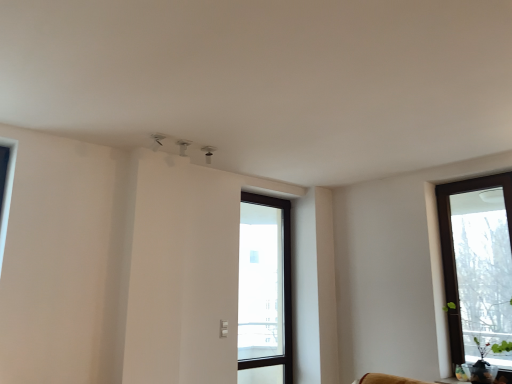
Question: From the image's perspective, does brown wooden window at right, arranged as the second window when viewed from the back, appear lower than transparent glass door at center, the second window in the front-to-back sequence?

Choices:
 (A) yes
 (B) no

Answer: (B)

Question: From a real-world perspective, is brown wooden window at right, acting as the first window starting from the right, physically above transparent glass door at center, arranged as the 2th window when viewed from the right?

Choices:
 (A) yes
 (B) no

Answer: (A)

Question: Would you consider brown wooden window at right, the first window from the front, to be distant from transparent glass door at center, arranged as the first window when viewed from the left?

Choices:
 (A) no
 (B) yes

Answer: (B)

Question: Is the depth of brown wooden window at right, the 2th window from the left, greater than that of transparent glass door at center, arranged as the 2th window when viewed from the right?

Choices:
 (A) no
 (B) yes

Answer: (A)

Question: Is brown wooden window at right, the first window from the front, turned away from transparent glass door at center, arranged as the 2th window when viewed from the right?

Choices:
 (A) yes
 (B) no

Answer: (B)

Question: Considering the relative sizes of brown wooden window at right, acting as the first window starting from the right, and transparent glass door at center, arranged as the first window when viewed from the left, in the image provided, is brown wooden window at right, acting as the first window starting from the right, smaller than transparent glass door at center, arranged as the first window when viewed from the left,?

Choices:
 (A) yes
 (B) no

Answer: (B)

Question: From the image's perspective, is transparent glass door at center, arranged as the first window when viewed from the left, on top of brown wooden window at right, arranged as the second window when viewed from the back?

Choices:
 (A) no
 (B) yes

Answer: (A)

Question: Does transparent glass door at center, arranged as the first window when viewed from the left, have a smaller size compared to brown wooden window at right, the first window from the front?

Choices:
 (A) yes
 (B) no

Answer: (A)

Question: Is brown wooden window at right, the first window from the front, at the back of transparent glass door at center, the second window in the front-to-back sequence?

Choices:
 (A) no
 (B) yes

Answer: (A)

Question: Does transparent glass door at center, arranged as the first window when viewed from the back, have a greater height compared to brown wooden window at right, the 2th window from the left?

Choices:
 (A) no
 (B) yes

Answer: (B)

Question: Is transparent glass door at center, arranged as the first window when viewed from the left, shorter than brown wooden window at right, acting as the first window starting from the right?

Choices:
 (A) no
 (B) yes

Answer: (A)

Question: Is transparent glass door at center, arranged as the first window when viewed from the back, positioned before brown wooden window at right, the 2th window from the left?

Choices:
 (A) no
 (B) yes

Answer: (A)

Question: Would you say brown wooden window at right, the first window from the front, is inside or outside transparent glass door at center, arranged as the first window when viewed from the left?

Choices:
 (A) inside
 (B) outside

Answer: (B)